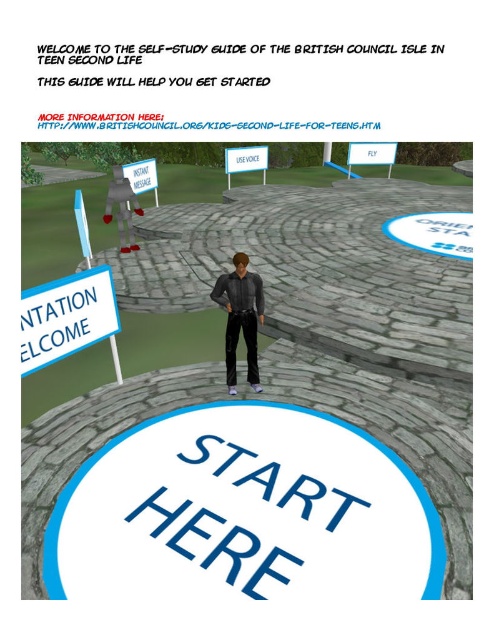
Can you confirm if matte black shirt at center is wider than white paper sign at center?

No, matte black shirt at center is not wider than white paper sign at center.

In the scene shown: Does matte black shirt at center have a greater height compared to white paper sign at center?

Yes.

Measure the distance between matte black shirt at center and camera.

matte black shirt at center is 3.97 meters from camera.

I want to click on matte black shirt at center, so click(241, 317).

Can you confirm if matte stone path at center is positioned below white paper sign at left?

No.

Who is lower down, matte stone path at center or white paper sign at left?

Positioned lower is white paper sign at left.

Is point (21, 561) more distant than point (63, 346)?

No, it is in front of (63, 346).

Where is `matte stone path at center`? The height and width of the screenshot is (640, 494). matte stone path at center is located at coordinates (279, 400).

Does matte stone path at center have a greater width compared to matte black shirt at center?

Indeed, matte stone path at center has a greater width compared to matte black shirt at center.

Is matte stone path at center closer to camera compared to matte black shirt at center?

Yes, it is in front of matte black shirt at center.

What do you see at coordinates (279, 400) in the screenshot? Image resolution: width=494 pixels, height=640 pixels. I see `matte stone path at center` at bounding box center [279, 400].

The height and width of the screenshot is (640, 494). In order to click on matte stone path at center in this screenshot , I will do `click(279, 400)`.